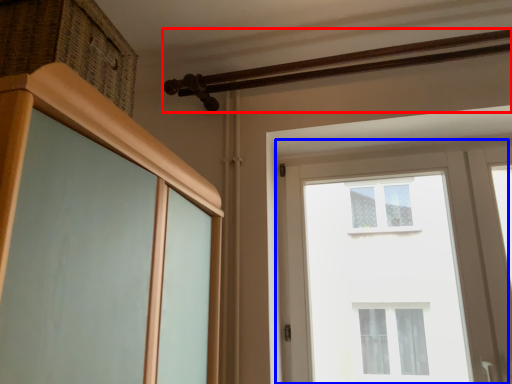
Question: Which object appears closest to the camera in this image, rail (highlighted by a red box) or window (highlighted by a blue box)?

Choices:
 (A) rail
 (B) window

Answer: (A)